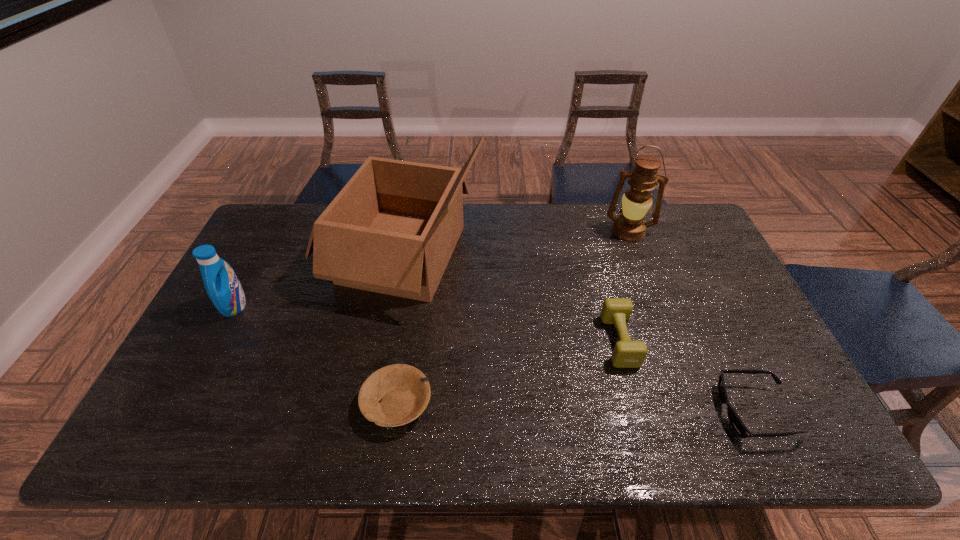
I want to click on free location located on the front-facing side of the detergent, so 352,306.

The height and width of the screenshot is (540, 960). Identify the location of vacant space situated 0.150m on the right of the fourth tallest object. (689, 341).

Find the location of a particular element. This screenshot has width=960, height=540. vacant position located on the front-facing side of the sunglasses is located at coordinates (560, 412).

Locate an element on the screen. This screenshot has width=960, height=540. free space located on the front-facing side of the sunglasses is located at coordinates (560, 412).

Identify the location of vacant space located on the front-facing side of the sunglasses. (576, 412).

The height and width of the screenshot is (540, 960). Find the location of `vacant space situated on the back of the bowl`. vacant space situated on the back of the bowl is located at coordinates (404, 355).

The height and width of the screenshot is (540, 960). Identify the location of box present at the far edge. (392, 229).

Image resolution: width=960 pixels, height=540 pixels. I want to click on oil lamp that is positioned at the far edge, so click(630, 226).

Where is `sunglasses at the near edge`? sunglasses at the near edge is located at coordinates (738, 426).

You are a GUI agent. You are given a task and a screenshot of the screen. Output one action in this format:
    pyautogui.click(x=<x>, y=<y>)
    Task: Click on the bowl that is at the near edge
    
    Given the screenshot: What is the action you would take?
    pyautogui.click(x=403, y=391)